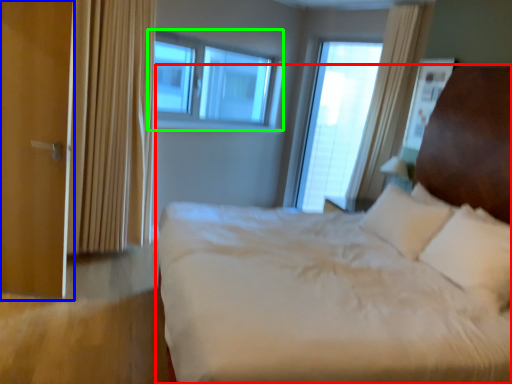
Question: Which object is the farthest from bed (highlighted by a red box)? Choose among these: screen door (highlighted by a blue box) or window (highlighted by a green box).

Choices:
 (A) screen door
 (B) window

Answer: (B)